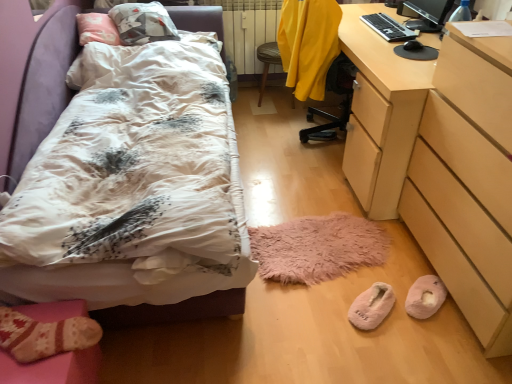
What do you see at coordinates (428, 14) in the screenshot?
I see `black glossy monitor at upper right` at bounding box center [428, 14].

I want to click on pink fuzzy slippers at lower center, which ranks as the 2th footwear in right-to-left order, so click(x=371, y=306).

This screenshot has height=384, width=512. What do you see at coordinates (440, 162) in the screenshot?
I see `light wood desk at right` at bounding box center [440, 162].

What do you see at coordinates (53, 368) in the screenshot? This screenshot has width=512, height=384. I see `knitted wool socks at lower left` at bounding box center [53, 368].

Measure the distance between point [439,300] and camera.

1.75 meters.

In order to click on black glossy monitor at upper right in this screenshot , I will do `click(428, 14)`.

Can you confirm if yellow fabric swivel chair at center, which is the first swivel chair in front-to-back order, is positioned to the right of pink fluffy slippers at lower right, the second footwear positioned from the left?

No.

Between yellow fabric swivel chair at center, which is the first swivel chair in front-to-back order, and pink fluffy slippers at lower right, positioned as the first footwear in right-to-left order, which one is positioned behind?

Positioned behind is yellow fabric swivel chair at center, which is the first swivel chair in front-to-back order.

From a real-world perspective, does yellow fabric swivel chair at center, the 2th swivel chair viewed from the back, stand above pink fluffy slippers at lower right, positioned as the first footwear in right-to-left order?

Yes, from a real-world perspective, yellow fabric swivel chair at center, the 2th swivel chair viewed from the back, is above pink fluffy slippers at lower right, positioned as the first footwear in right-to-left order.

Considering the positions of point (382, 21) and point (436, 29), is point (382, 21) closer or farther from the camera than point (436, 29)?

Point (382, 21) is positioned farther from the camera compared to point (436, 29).

Considering the sizes of objects black plastic keyboard at upper right and black glossy monitor at upper right in the image provided, who is shorter, black plastic keyboard at upper right or black glossy monitor at upper right?

black plastic keyboard at upper right.

Could you tell me if black plastic keyboard at upper right is facing black glossy monitor at upper right?

No.

In the image, is black plastic keyboard at upper right on the left side or the right side of black glossy monitor at upper right?

In the image, black plastic keyboard at upper right appears on the left side of black glossy monitor at upper right.

Which object is further away from the camera, black plastic keyboard at upper right or knitted wool socks at lower left?

black plastic keyboard at upper right is more distant.

Is black plastic keyboard at upper right far away from knitted wool socks at lower left?

Yes.

From a real-world perspective, which object stands above the other?

In real-world perspective, black plastic keyboard at upper right is above.

Considering the relative sizes of white floral duvet at left and yellow fabric swivel chair at center, the 2th swivel chair viewed from the back, in the image provided, is white floral duvet at left taller than yellow fabric swivel chair at center, the 2th swivel chair viewed from the back,?

No.

From a real-world perspective, is white floral duvet at left physically above yellow fabric swivel chair at center, which is the first swivel chair in front-to-back order?

Actually, white floral duvet at left is physically below yellow fabric swivel chair at center, which is the first swivel chair in front-to-back order, in the real world.

Is point (203, 18) positioned after point (334, 50)?

Yes, it is.

From the image's perspective, would you say white floral duvet at left is shown under yellow fabric swivel chair at center, which is the first swivel chair in front-to-back order?

Correct, white floral duvet at left appears lower than yellow fabric swivel chair at center, which is the first swivel chair in front-to-back order, in the image.

Based on the photo, considering the relative sizes of knitted wool socks at lower left and yellow fabric swivel chair at center, the 2th swivel chair viewed from the back, in the image provided, is knitted wool socks at lower left shorter than yellow fabric swivel chair at center, the 2th swivel chair viewed from the back,?

Indeed, knitted wool socks at lower left has a lesser height compared to yellow fabric swivel chair at center, the 2th swivel chair viewed from the back.

Is knitted wool socks at lower left outside of yellow fabric swivel chair at center, the 2th swivel chair viewed from the back?

Yes, knitted wool socks at lower left is located beyond the bounds of yellow fabric swivel chair at center, the 2th swivel chair viewed from the back.

I want to click on furniture lying below the yellow fabric swivel chair at center, which is the first swivel chair in front-to-back order (from the image's perspective), so click(x=53, y=368).

From the picture: Is the depth of knitted wool socks at lower left greater than that of yellow fabric swivel chair at center, the 2th swivel chair viewed from the back?

No, it is not.

Is pink fluffy slippers at lower right, the second footwear positioned from the left, next to black glossy monitor at upper right and touching it?

No, pink fluffy slippers at lower right, the second footwear positioned from the left, is not making contact with black glossy monitor at upper right.

Based on their positions, is pink fluffy slippers at lower right, the second footwear positioned from the left, located to the left or right of black glossy monitor at upper right?

pink fluffy slippers at lower right, the second footwear positioned from the left, is to the left of black glossy monitor at upper right.

How far apart are pink fluffy slippers at lower right, the second footwear positioned from the left, and black glossy monitor at upper right?

pink fluffy slippers at lower right, the second footwear positioned from the left, is 1.53 meters away from black glossy monitor at upper right.

In the scene shown: Can you confirm if pink fluffy slippers at lower right, the second footwear positioned from the left, is taller than black glossy monitor at upper right?

Incorrect, the height of pink fluffy slippers at lower right, the second footwear positioned from the left, is not larger of that of black glossy monitor at upper right.

Which is behind, pink fuzzy slippers at lower center, which ranks as the 2th footwear in right-to-left order, or black plastic keyboard at upper right?

black plastic keyboard at upper right.

Is pink fuzzy slippers at lower center, which ranks as the 2th footwear in right-to-left order, oriented towards black plastic keyboard at upper right?

No, pink fuzzy slippers at lower center, which ranks as the 2th footwear in right-to-left order, does not turn towards black plastic keyboard at upper right.

Is black plastic keyboard at upper right a part of pink fuzzy slippers at lower center, which is counted as the first footwear, starting from the left?

Actually, black plastic keyboard at upper right is outside pink fuzzy slippers at lower center, which is counted as the first footwear, starting from the left.

Which object is thinner, pink fuzzy slippers at lower center, which ranks as the 2th footwear in right-to-left order, or black plastic keyboard at upper right?

black plastic keyboard at upper right.

Find the location of a particular element. This screenshot has width=512, height=384. the 2nd footwear counting from the right of the yellow fabric swivel chair at center, the 2th swivel chair viewed from the back is located at coordinates (425, 297).

Locate an element on the screen. This screenshot has height=384, width=512. computer monitor that appears in front of the black plastic keyboard at upper right is located at coordinates (428, 14).

Which object lies further to the anchor point light wood desk at right, pink fluffy slippers at lower right, positioned as the first footwear in right-to-left order, or yellow fabric swivel chair at center, which is the first swivel chair in front-to-back order?

yellow fabric swivel chair at center, which is the first swivel chair in front-to-back order, lies further to light wood desk at right than the other object.

Based on their spatial positions, is black plastic keyboard at upper right or light wood desk at right further from black glossy monitor at upper right?

light wood desk at right lies further to black glossy monitor at upper right than the other object.

From the image, which object appears to be nearer to black glossy monitor at upper right, knitted wool socks at lower left or pink fluffy slippers at lower right, positioned as the first footwear in right-to-left order?

pink fluffy slippers at lower right, positioned as the first footwear in right-to-left order, is positioned closer to the anchor black glossy monitor at upper right.

In the scene shown: Considering their positions, is pink fluffy slippers at lower right, positioned as the first footwear in right-to-left order, positioned further to black plastic keyboard at upper right than yellow fabric swivel chair at center, the second swivel chair when ordered from front to back?

Based on the image, pink fluffy slippers at lower right, positioned as the first footwear in right-to-left order, appears to be further to black plastic keyboard at upper right.

Estimate the real-world distances between objects in this image. Which object is closer to white floral duvet at left, light wood desk at right or pink fluffy slippers at lower right, the second footwear positioned from the left?

light wood desk at right.

Looking at this image, considering their positions, is light wood desk at right positioned closer to pink fuzzy slippers at lower center, which is counted as the first footwear, starting from the left, than black glossy monitor at upper right?

light wood desk at right.

Looking at the image, which one is located further to black plastic keyboard at upper right, pink fluffy slippers at lower right, the second footwear positioned from the left, or light wood desk at right?

pink fluffy slippers at lower right, the second footwear positioned from the left.

When comparing their distances from pink fluffy slippers at lower right, the second footwear positioned from the left, does black plastic keyboard at upper right or black glossy monitor at upper right seem further?

black glossy monitor at upper right lies further to pink fluffy slippers at lower right, the second footwear positioned from the left, than the other object.

This screenshot has width=512, height=384. Find the location of `bed that lies between yellow fabric swivel chair at center, the 2th swivel chair viewed from the back, and pink fuzzy slippers at lower center, which ranks as the 2th footwear in right-to-left order, from top to bottom`. bed that lies between yellow fabric swivel chair at center, the 2th swivel chair viewed from the back, and pink fuzzy slippers at lower center, which ranks as the 2th footwear in right-to-left order, from top to bottom is located at coordinates (44, 86).

Find the location of a particular element. Image resolution: width=512 pixels, height=384 pixels. desk that lies between yellow fabric swivel chair at center, which is the first swivel chair in front-to-back order, and pink fluffy slippers at lower right, positioned as the first footwear in right-to-left order, from top to bottom is located at coordinates (440, 162).

Locate an element on the screen. swivel chair located between light wood desk at right and black plastic keyboard at upper right in the depth direction is located at coordinates (313, 56).

The width and height of the screenshot is (512, 384). I want to click on computer monitor located between white floral duvet at left and yellow fabric swivel chair at center, the second swivel chair when ordered from front to back, in the depth direction, so click(x=428, y=14).